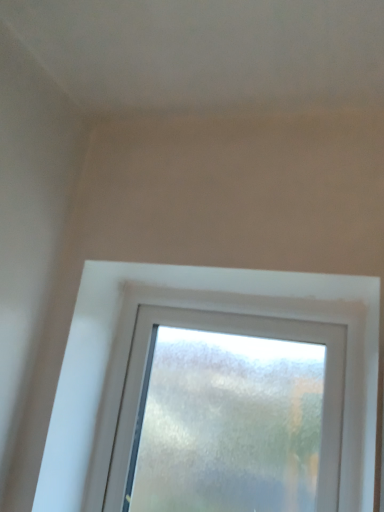
In order to face frosted glass window at center, should I rotate leftwards or rightwards?

Rotate your view right by about 3.940°.

What is the approximate width of frosted glass window at center?

frosted glass window at center is 6.59 centimeters wide.

Describe the element at coordinates (201, 308) in the screenshot. I see `frosted glass window at center` at that location.

At what (x,y) coordinates should I click in order to perform the action: click on frosted glass window at center. Please return your answer as a coordinate pair (x, y). Image resolution: width=384 pixels, height=512 pixels. Looking at the image, I should click on (201, 308).

You are a GUI agent. You are given a task and a screenshot of the screen. Output one action in this format:
    pyautogui.click(x=<x>, y=<y>)
    Task: Click on the frosted glass window at center
    This screenshot has height=512, width=384.
    Given the screenshot: What is the action you would take?
    pyautogui.click(x=201, y=308)